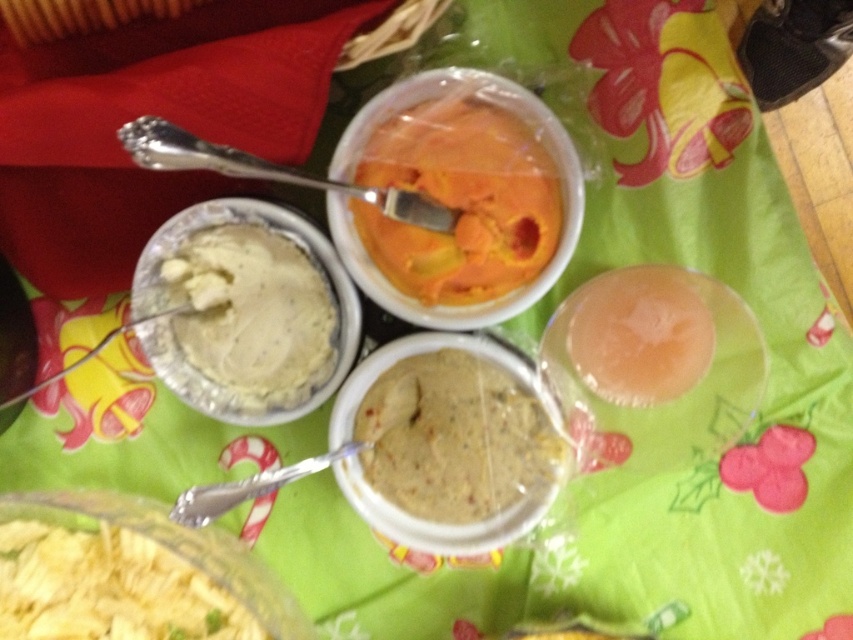
You are a food critic observing the table setting described. Which food item is positioned higher up between the orange matte ice cream at center and the white creamy paste at center?

The orange matte ice cream at center is located above the white creamy paste at center, so it is positioned higher up.

You are a chef standing at the table and want to reach the white creamy paste at center to taste it. Can you estimate how far it is from your eyes?

The white creamy paste at center is 22.61 inches from the viewer, so it is approximately 22.61 inches away from your eyes.